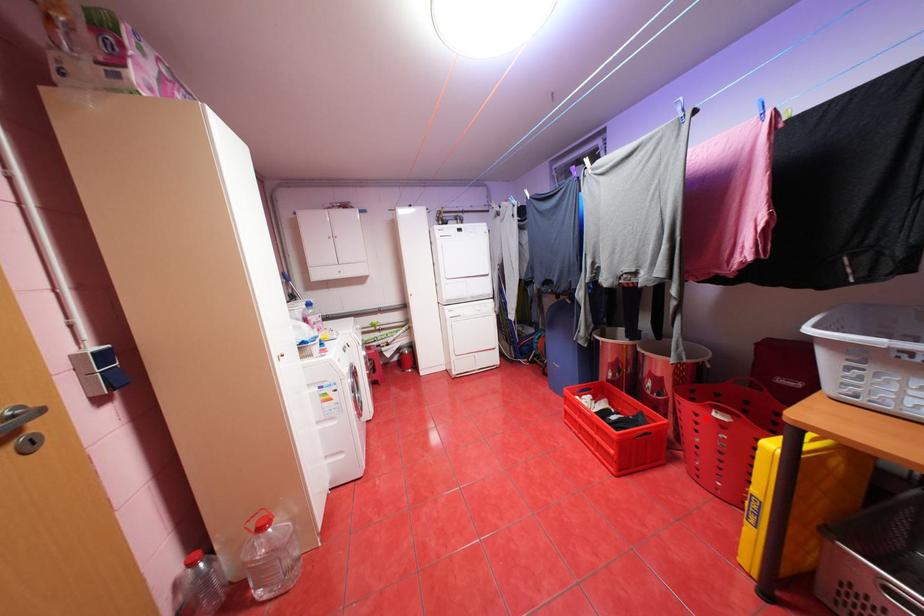
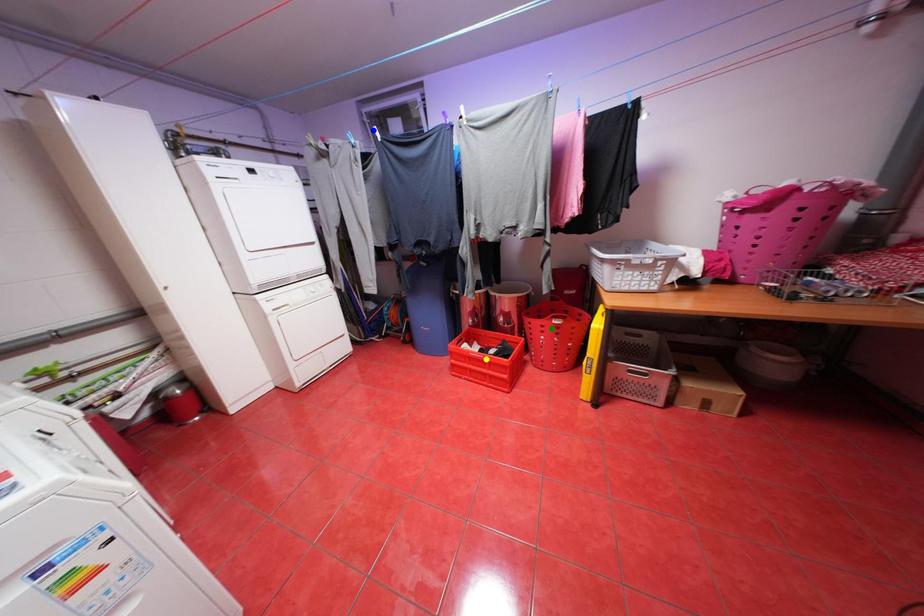
Question: I am providing you with two images of the same scene from different viewpoints. A red point is marked on the first image. You are given multiple points on the second image. Which spot in image 2 lines up with the point in image 1?

Choices:
 (A) yellow point
 (B) blue point
 (C) green point

Answer: (C)